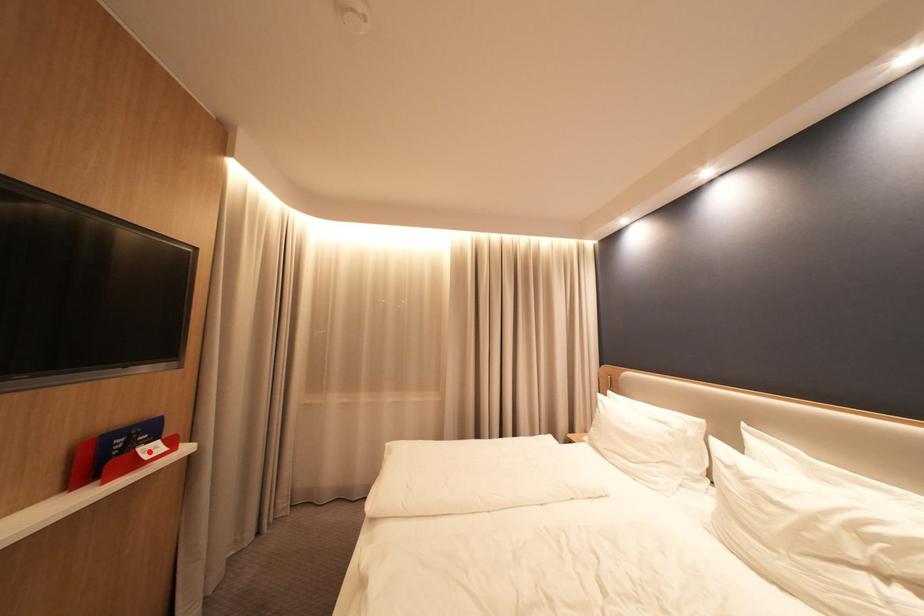
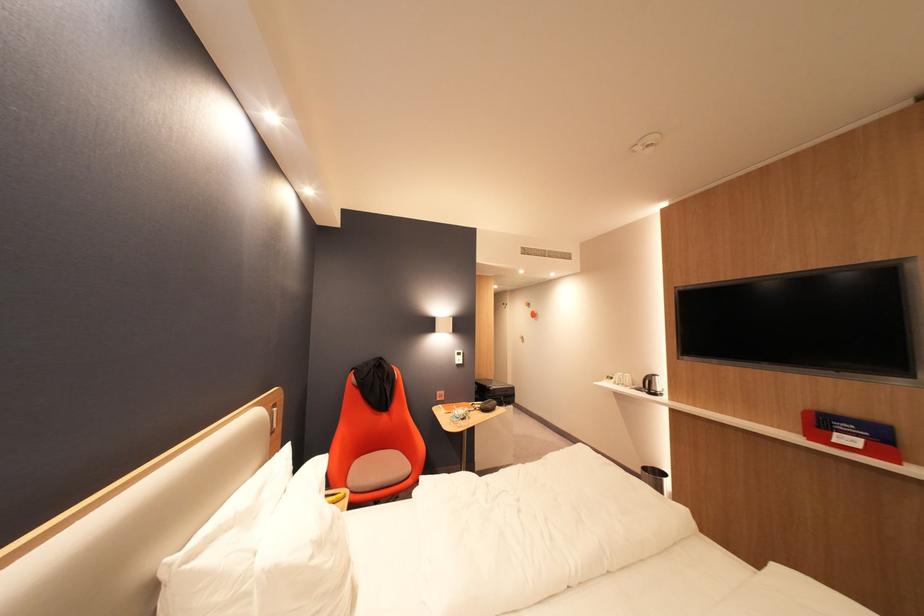
Where in the second image is the point corresponding to the highlighted location from the first image?

(846, 435)